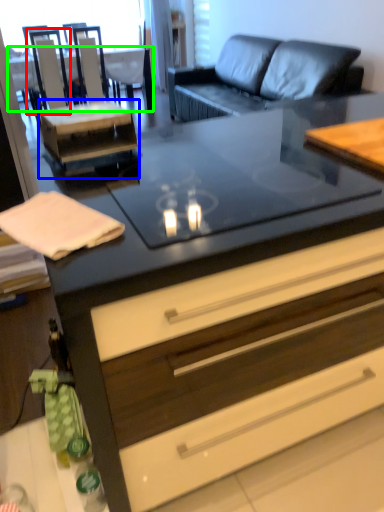
Question: Considering the real-world distances, which object is closest to armchair (highlighted by a red box)? side table (highlighted by a blue box) or desk (highlighted by a green box).

Choices:
 (A) side table
 (B) desk

Answer: (A)